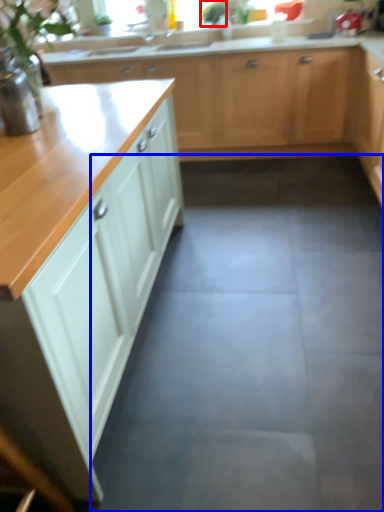
Question: Among these objects, which one is nearest to the camera, plant (highlighted by a red box) or concrete (highlighted by a blue box)?

Choices:
 (A) plant
 (B) concrete

Answer: (B)